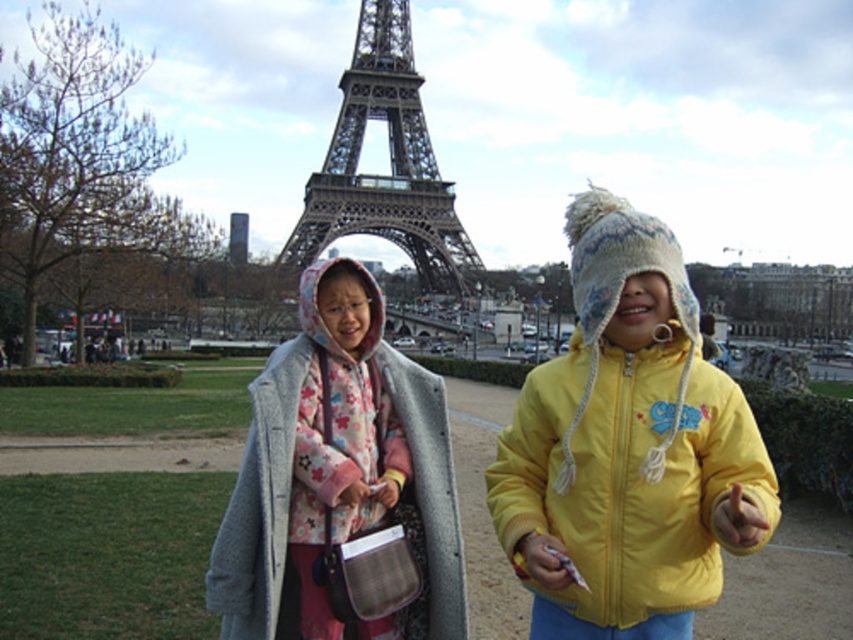
Question: Does fluffy gray coat at center appear over metallic structure at center?

Choices:
 (A) yes
 (B) no

Answer: (B)

Question: Which of these objects is positioned closest to the fluffy gray coat at center?

Choices:
 (A) metallic structure at center
 (B) yellow fleece jacket at center

Answer: (A)

Question: Does yellow fleece jacket at center appear over metallic structure at center?

Choices:
 (A) no
 (B) yes

Answer: (A)

Question: Does yellow fleece jacket at center appear on the right side of fluffy gray coat at center?

Choices:
 (A) yes
 (B) no

Answer: (A)

Question: Based on their relative distances, which object is nearer to the fluffy gray coat at center?

Choices:
 (A) yellow fleece jacket at center
 (B) metallic structure at center

Answer: (B)

Question: Which of the following is the farthest from the observer?

Choices:
 (A) (384, 436)
 (B) (614, 572)

Answer: (A)